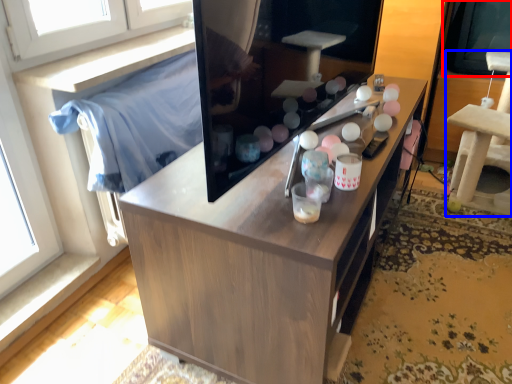
Question: Which point is further to the camera, window screen (highlighted by a red box) or furniture (highlighted by a blue box)?

Choices:
 (A) window screen
 (B) furniture

Answer: (A)